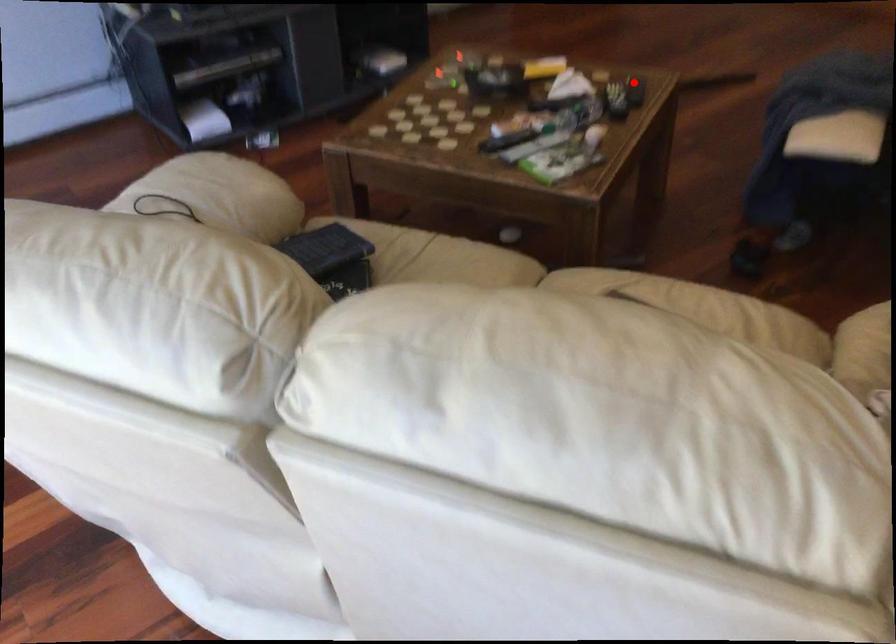
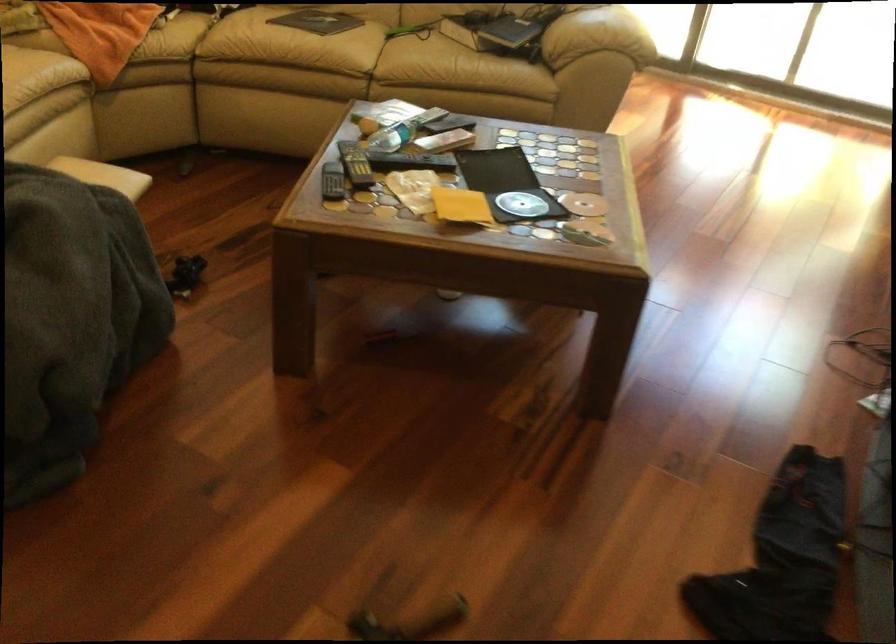
Question: I am providing you with two images of the same scene from different viewpoints. A red point is shown in image1. For the corresponding object point in image2, is it positioned nearer or farther from the camera?

Choices:
 (A) Nearer
 (B) Farther

Answer: (A)